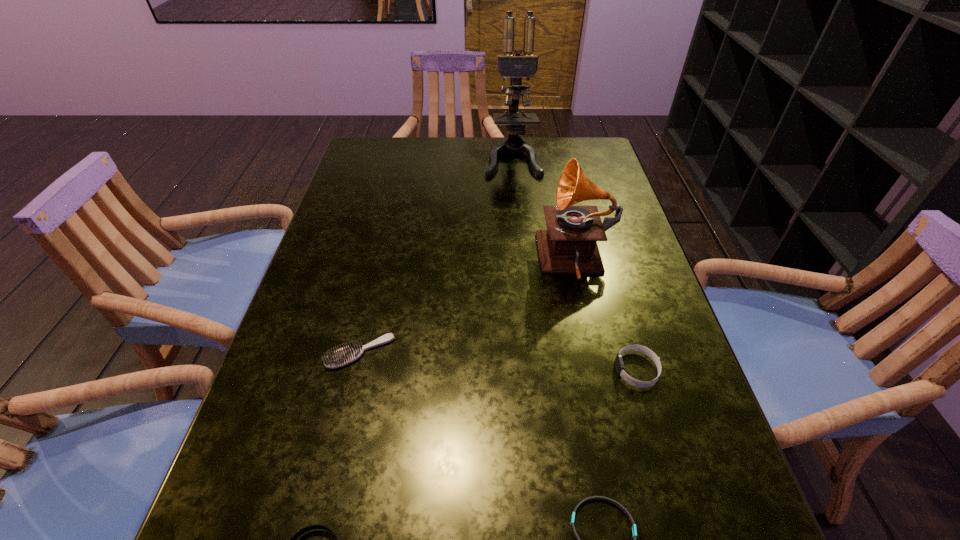
Where is `free location that satisfies the following two spatial constraints: 1. on the horn of the second farthest object; 2. on the front side of the scrubbing brush`? This screenshot has width=960, height=540. free location that satisfies the following two spatial constraints: 1. on the horn of the second farthest object; 2. on the front side of the scrubbing brush is located at coordinates (597, 352).

Locate an element on the screen. The height and width of the screenshot is (540, 960). free space that satisfies the following two spatial constraints: 1. on the horn of the fifth nearest object; 2. on the front side of the scrubbing brush is located at coordinates (597, 352).